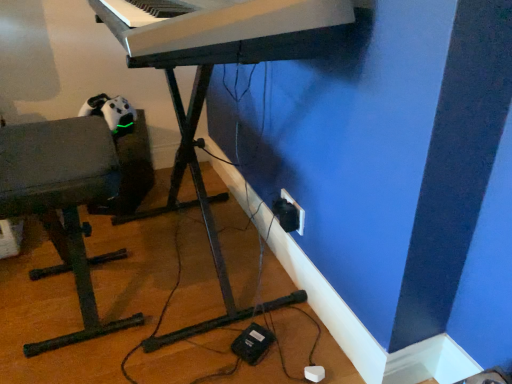
Question: Would you consider black plastic electric outlet at lower right to be distant from black plastic plug at lower right?

Choices:
 (A) no
 (B) yes

Answer: (A)

Question: Could you tell me if black plastic electric outlet at lower right is facing black plastic plug at lower right?

Choices:
 (A) yes
 (B) no

Answer: (A)

Question: From a real-world perspective, is black plastic electric outlet at lower right located higher than black plastic plug at lower right?

Choices:
 (A) no
 (B) yes

Answer: (A)

Question: Considering the relative sizes of black plastic electric outlet at lower right and black plastic plug at lower right in the image provided, is black plastic electric outlet at lower right smaller than black plastic plug at lower right?

Choices:
 (A) no
 (B) yes

Answer: (B)

Question: Can you confirm if black plastic electric outlet at lower right is taller than black plastic plug at lower right?

Choices:
 (A) no
 (B) yes

Answer: (B)

Question: Looking at the image, does black plastic plug at lower right seem bigger or smaller compared to black plastic electric outlet at lower right?

Choices:
 (A) big
 (B) small

Answer: (A)

Question: From a real-world perspective, relative to black plastic electric outlet at lower right, is black plastic plug at lower right vertically above or below?

Choices:
 (A) below
 (B) above

Answer: (B)

Question: Is point (274, 213) positioned closer to the camera than point (296, 206)?

Choices:
 (A) closer
 (B) farther

Answer: (B)

Question: From the image's perspective, is black plastic plug at lower right positioned above or below black plastic electric outlet at lower right?

Choices:
 (A) above
 (B) below

Answer: (B)

Question: Is matte gray bench at left to the left or to the right of white plastic keyboard at upper center in the image?

Choices:
 (A) right
 (B) left

Answer: (B)

Question: Considering the positions of matte gray bench at left and white plastic keyboard at upper center in the image, is matte gray bench at left wider or thinner than white plastic keyboard at upper center?

Choices:
 (A) thin
 (B) wide

Answer: (A)

Question: In the image, is matte gray bench at left positioned in front of or behind white plastic keyboard at upper center?

Choices:
 (A) behind
 (B) front

Answer: (A)

Question: Considering the positions of matte gray bench at left and white plastic keyboard at upper center in the image, is matte gray bench at left taller or shorter than white plastic keyboard at upper center?

Choices:
 (A) tall
 (B) short

Answer: (A)

Question: Is point (16, 178) positioned closer to the camera than point (287, 200)?

Choices:
 (A) farther
 (B) closer

Answer: (B)

Question: Is matte gray bench at left inside or outside of black plastic electric outlet at lower right?

Choices:
 (A) outside
 (B) inside

Answer: (A)